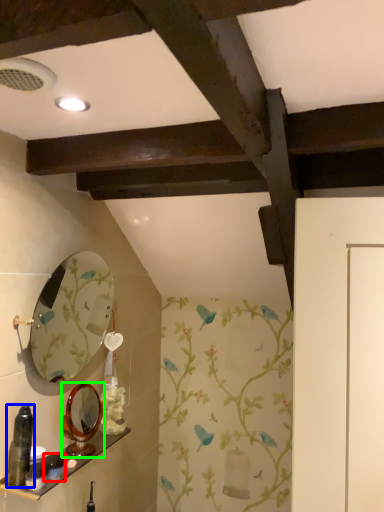
Question: Considering the real-world distances, which object is closest to toiletry (highlighted by a red box)? bottle (highlighted by a blue box) or mirror (highlighted by a green box).

Choices:
 (A) bottle
 (B) mirror

Answer: (B)